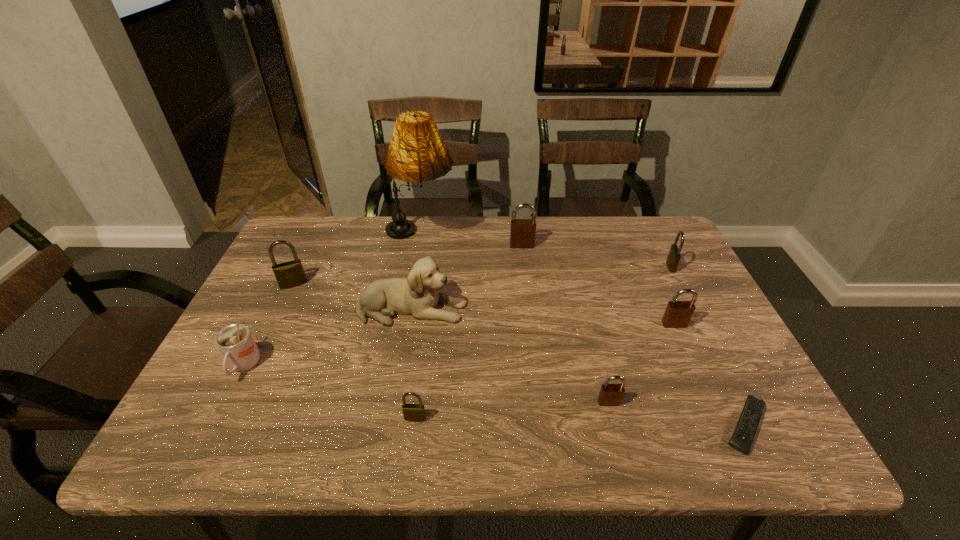
Where is `free point between the lampshade and the fourth object from right to left`? free point between the lampshade and the fourth object from right to left is located at coordinates (515, 319).

In order to click on vacant space in between the second padlock from right to left and the white puppy in this screenshot , I will do `click(543, 316)`.

What are the coordinates of `blank region between the tallest object and the second smallest brown padlock` in the screenshot? It's located at (547, 280).

I want to click on free space between the shortest object and the cup, so pyautogui.click(x=495, y=396).

At what (x,y) coordinates should I click in order to perform the action: click on vacant area that lies between the fourth farthest object and the shortest object. Please return your answer as a coordinate pair (x, y). The image size is (960, 540). Looking at the image, I should click on (519, 355).

Where is `vacant area between the fourth nearest object and the shortest object`? The width and height of the screenshot is (960, 540). vacant area between the fourth nearest object and the shortest object is located at coordinates (495, 396).

Where is `vacant area that lies between the tallest object and the nearest brown padlock`? The height and width of the screenshot is (540, 960). vacant area that lies between the tallest object and the nearest brown padlock is located at coordinates (515, 319).

The width and height of the screenshot is (960, 540). I want to click on vacant space that's between the smallest brass padlock and the shortest object, so click(581, 422).

At what (x,y) coordinates should I click in order to perform the action: click on unoccupied area between the nearest brown padlock and the lampshade. Please return your answer as a coordinate pair (x, y). Looking at the image, I should click on (515, 319).

Identify the location of free space between the fourth nearest object and the remote control. (495, 396).